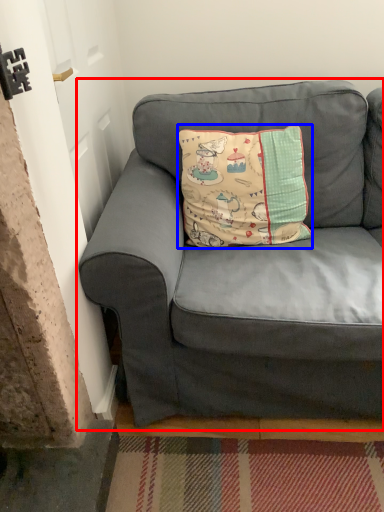
Question: Which object is closer to the camera taking this photo, studio couch (highlighted by a red box) or pillow (highlighted by a blue box)?

Choices:
 (A) studio couch
 (B) pillow

Answer: (A)